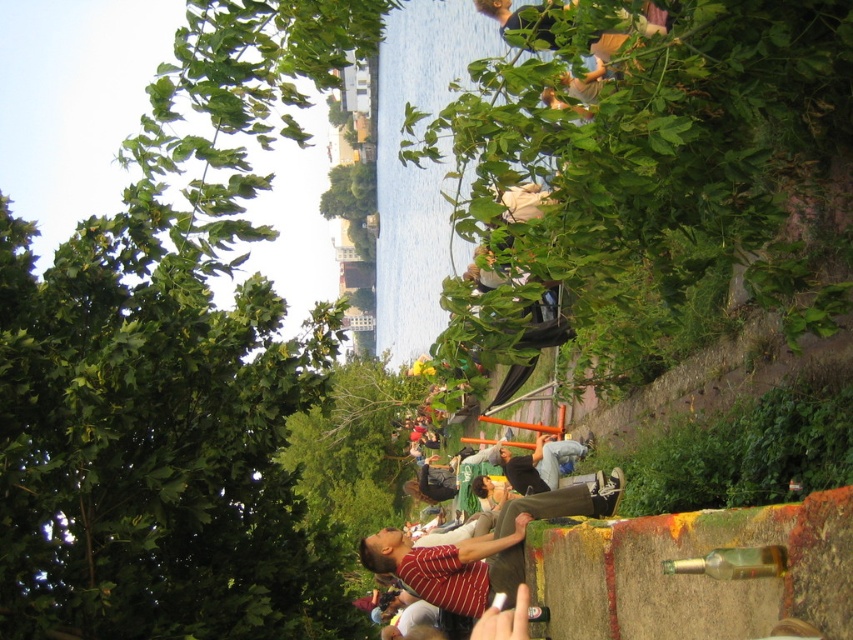
Question: Which point is closer to the camera?

Choices:
 (A) (115, 452)
 (B) (497, 456)
 (C) (467, 584)

Answer: (A)

Question: Does green leafy tree at upper left have a greater width compared to striped cotton shirt at center?

Choices:
 (A) no
 (B) yes

Answer: (B)

Question: Considering the real-world distances, which object is farthest from the dark gray fabric pants at center?

Choices:
 (A) striped cotton shirt at center
 (B) green leafy tree at upper left

Answer: (B)

Question: Does green leafy tree at upper left appear on the left side of dark gray fabric pants at center?

Choices:
 (A) yes
 (B) no

Answer: (A)

Question: Which object is positioned farthest from the striped cotton shirt at center?

Choices:
 (A) dark gray fabric pants at center
 (B) green leafy tree at upper left

Answer: (A)

Question: Is green leafy tree at upper left thinner than dark gray fabric pants at center?

Choices:
 (A) yes
 (B) no

Answer: (B)